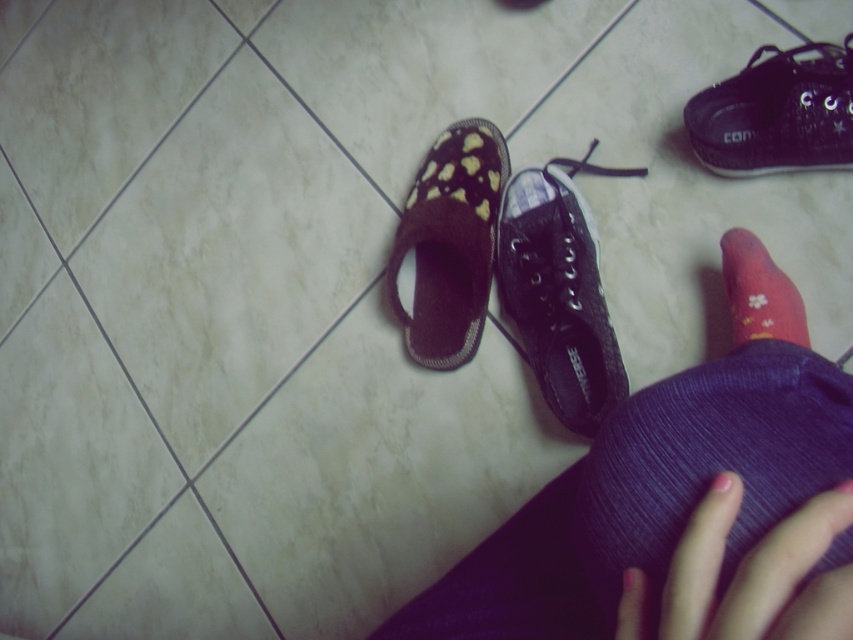
Question: Which object appears closest to the camera in this image?

Choices:
 (A) black canvas shoe at center
 (B) shiny black sneaker at upper right
 (C) pink floral sock at lower right
 (D) pink fabric toe at lower center

Answer: (D)

Question: Can you confirm if purple fabric pants at center is positioned to the right of pink fabric toe at lower center?

Choices:
 (A) yes
 (B) no

Answer: (B)

Question: Is brown fuzzy slipper at center-left below pink matte toe at center?

Choices:
 (A) no
 (B) yes

Answer: (A)

Question: Which of the following is the farthest from the observer?

Choices:
 (A) (608, 531)
 (B) (556, 204)
 (C) (837, 484)

Answer: (B)

Question: Which of the following is the farthest from the observer?

Choices:
 (A) pink floral sock at lower right
 (B) shiny black sneaker at upper right
 (C) black canvas shoe at center
 (D) pink matte toe at center

Answer: (C)

Question: Does black canvas shoe at center appear on the left side of pink fabric toe at lower center?

Choices:
 (A) yes
 (B) no

Answer: (A)